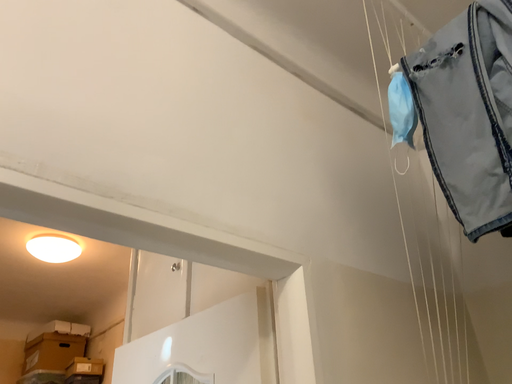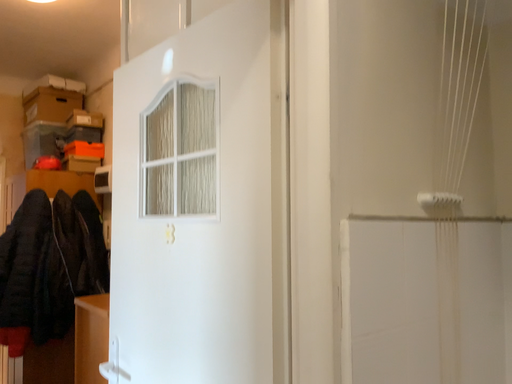
Question: Which way did the camera rotate in the video?

Choices:
 (A) rotated upward
 (B) rotated downward

Answer: (B)